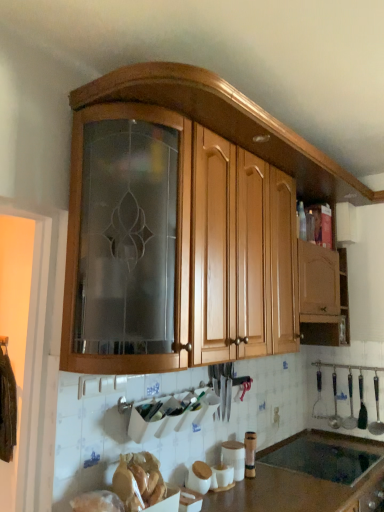
Locate an element on the screen. white matte screen door at left is located at coordinates (28, 371).

The height and width of the screenshot is (512, 384). What are the coordinates of `metallic silver spoon at lower right, positioned as the second silverware in right-to-left order` in the screenshot? It's located at (350, 406).

What do you see at coordinates (350, 406) in the screenshot? This screenshot has height=512, width=384. I see `metallic silver spoon at lower right, positioned as the second silverware in right-to-left order` at bounding box center [350, 406].

This screenshot has height=512, width=384. What do you see at coordinates (234, 457) in the screenshot?
I see `white glossy canister at lower center, placed as the second appliance when sorted from left to right` at bounding box center [234, 457].

Measure the distance between point (378,425) and camera.

A distance of 2.67 meters exists between point (378,425) and camera.

Describe the element at coordinates (309, 476) in the screenshot. Image resolution: width=384 pixels, height=512 pixels. I see `brown laminate countertop at lower center` at that location.

I want to click on white matte screen door at left, so click(28, 371).

Does white matte canister at lower center, the 2th appliance from the right, turn towards black matte sink at lower center?

No, white matte canister at lower center, the 2th appliance from the right, is not aimed at black matte sink at lower center.

From a real-world perspective, between white matte canister at lower center, the second appliance positioned from the back, and black matte sink at lower center, who is vertically lower?

black matte sink at lower center is physically lower.

Considering the relative positions of white matte canister at lower center, positioned as the 1th appliance in front-to-back order, and black matte sink at lower center in the image provided, is white matte canister at lower center, positioned as the 1th appliance in front-to-back order, to the left or to the right of black matte sink at lower center?

Clearly, white matte canister at lower center, positioned as the 1th appliance in front-to-back order, is on the left of black matte sink at lower center in the image.

Considering the points (202, 487) and (293, 456), which point is in front, point (202, 487) or point (293, 456)?

The point (202, 487) is closer.

Would you say white matte canister at lower center, positioned as the 1th appliance in front-to-back order, is part of wooden cabinet at upper center's contents?

Definitely not — white matte canister at lower center, positioned as the 1th appliance in front-to-back order, is not inside wooden cabinet at upper center.

Between wooden cabinet at upper center and white matte canister at lower center, the second appliance positioned from the back, which one has larger width?

wooden cabinet at upper center.

Which is behind, point (296, 152) or point (206, 483)?

The point (296, 152) is behind.

Is the surface of wooden cabinet at upper center in direct contact with white matte canister at lower center, the second appliance positioned from the back?

There is a gap between wooden cabinet at upper center and white matte canister at lower center, the second appliance positioned from the back.

Between polished metal ladle at right, which is the 2th silverware in left-to-right order, and white glossy canister at lower center, placed as the second appliance when sorted from left to right, which one has more height?

polished metal ladle at right, which is the 2th silverware in left-to-right order, is taller.

From a real-world perspective, is polished metal ladle at right, positioned as the first silverware in right-to-left order, positioned over white glossy canister at lower center, the 1th appliance from the right, based on gravity?

Indeed, from a real-world perspective, polished metal ladle at right, positioned as the first silverware in right-to-left order, stands above white glossy canister at lower center, the 1th appliance from the right.

At what (x,y) coordinates should I click in order to perform the action: click on appliance that is the 1st one below the polished metal ladle at right, which is the 2th silverware in left-to-right order (from a real-world perspective). Please return your answer as a coordinate pair (x, y). Image resolution: width=384 pixels, height=512 pixels. Looking at the image, I should click on (234, 457).

From the image's perspective, does polished metal ladle at right, which is the 2th silverware in left-to-right order, appear higher than white glossy canister at lower center, the 1th appliance from the right?

Yes, from the image's perspective, polished metal ladle at right, which is the 2th silverware in left-to-right order, is above white glossy canister at lower center, the 1th appliance from the right.

Which is more to the left, white glossy canister at lower center, placed as the second appliance when sorted from left to right, or white matte canister at lower center, the 2th appliance from the right?

From the viewer's perspective, white matte canister at lower center, the 2th appliance from the right, appears more on the left side.

Does white glossy canister at lower center, the 1th appliance from the right, touch white matte canister at lower center, the second appliance positioned from the back?

No, white glossy canister at lower center, the 1th appliance from the right, is not next to white matte canister at lower center, the second appliance positioned from the back.

Can you confirm if white glossy canister at lower center, placed as the second appliance when sorted from left to right, is shorter than white matte canister at lower center, positioned as the 1th appliance in front-to-back order?

No, white glossy canister at lower center, placed as the second appliance when sorted from left to right, is not shorter than white matte canister at lower center, positioned as the 1th appliance in front-to-back order.

Can you confirm if black matte sink at lower center is positioned to the right of brown laminate countertop at lower center?

Correct, you'll find black matte sink at lower center to the right of brown laminate countertop at lower center.

Can you tell me how much black matte sink at lower center and brown laminate countertop at lower center differ in facing direction?

There is a 0.000223-degree angle between the facing directions of black matte sink at lower center and brown laminate countertop at lower center.

Is black matte sink at lower center in contact with brown laminate countertop at lower center?

Yes, black matte sink at lower center is beside brown laminate countertop at lower center.

Considering the sizes of objects white matte screen door at left and white glossy canister at lower center, placed as the second appliance when sorted from left to right, in the image provided, who is wider, white matte screen door at left or white glossy canister at lower center, placed as the second appliance when sorted from left to right,?

Wider between the two is white glossy canister at lower center, placed as the second appliance when sorted from left to right.

Considering the relative positions of white matte screen door at left and white glossy canister at lower center, the 1th appliance from the right, in the image provided, is white matte screen door at left in front of white glossy canister at lower center, the 1th appliance from the right,?

Yes, it is in front of white glossy canister at lower center, the 1th appliance from the right.

At what (x,y) coordinates should I click in order to perform the action: click on screen door above the white glossy canister at lower center, the second appliance when ordered from front to back (from the image's perspective). Please return your answer as a coordinate pair (x, y). The width and height of the screenshot is (384, 512). Looking at the image, I should click on (28, 371).

Is white matte screen door at left oriented away from white glossy canister at lower center, the second appliance when ordered from front to back?

No, white matte screen door at left is not facing away from white glossy canister at lower center, the second appliance when ordered from front to back.

Is black matte sink at lower center completely or partially inside white matte screen door at left?

Definitely not — black matte sink at lower center is not inside white matte screen door at left.

This screenshot has width=384, height=512. I want to click on screen door lying on the left of black matte sink at lower center, so click(x=28, y=371).

Considering their positions, is white matte screen door at left located in front of or behind black matte sink at lower center?

Clearly, white matte screen door at left is in front of black matte sink at lower center.

I want to click on sink directly beneath the white matte canister at lower center, positioned as the 1th appliance in front-to-back order (from a real-world perspective), so click(322, 460).

Image resolution: width=384 pixels, height=512 pixels. I want to click on cabinetry located on the right of white matte canister at lower center, positioned as the 1th appliance in front-to-back order, so click(223, 122).

From the picture: Which object lies nearer to the anchor point white matte screen door at left, metallic silver spoon at lower right, positioned as the second silverware in right-to-left order, or wooden cabinet at upper center?

Based on the image, wooden cabinet at upper center appears to be nearer to white matte screen door at left.

Looking at this image, from the image, which object appears to be nearer to black matte sink at lower center, metallic silver spoon at lower right, marked as the 1th silverware in a left-to-right arrangement, or white matte canister at lower center, positioned as the 1th appliance in front-to-back order?

metallic silver spoon at lower right, marked as the 1th silverware in a left-to-right arrangement, is closer to black matte sink at lower center.

From the image, which object appears to be farther from brown laminate countertop at lower center, black matte sink at lower center or white matte screen door at left?

Based on the image, white matte screen door at left appears to be further to brown laminate countertop at lower center.

Estimate the real-world distances between objects in this image. Which object is further from wooden cabinet at upper center, polished metal ladle at right, positioned as the first silverware in right-to-left order, or metallic silver spoon at lower right, marked as the 1th silverware in a left-to-right arrangement?

Based on the image, metallic silver spoon at lower right, marked as the 1th silverware in a left-to-right arrangement, appears to be further to wooden cabinet at upper center.

Which object lies further to the anchor point black matte sink at lower center, polished metal ladle at right, which is the 2th silverware in left-to-right order, or white matte screen door at left?

white matte screen door at left is positioned further to the anchor black matte sink at lower center.

Based on their spatial positions, is white matte screen door at left or white glossy canister at lower center, placed as the second appliance when sorted from left to right, further from brown laminate countertop at lower center?

white matte screen door at left.

In the scene shown: From the image, which object appears to be farther from metallic silver spoon at lower right, positioned as the second silverware in right-to-left order, polished metal ladle at right, which is the 2th silverware in left-to-right order, or black matte sink at lower center?

Based on the image, black matte sink at lower center appears to be further to metallic silver spoon at lower right, positioned as the second silverware in right-to-left order.

Looking at the image, which one is located closer to brown laminate countertop at lower center, black matte sink at lower center or white matte canister at lower center, the second appliance positioned from the back?

The object closer to brown laminate countertop at lower center is black matte sink at lower center.

The image size is (384, 512). Identify the location of silverware situated between white matte screen door at left and polished metal ladle at right, which is the 2th silverware in left-to-right order, from left to right. (350, 406).

You are a GUI agent. You are given a task and a screenshot of the screen. Output one action in this format:
    pyautogui.click(x=<x>, y=<y>)
    Task: Click on the sink between brown laminate countertop at lower center and polished metal ladle at right, which is the 2th silverware in left-to-right order, from front to back
    This screenshot has height=512, width=384.
    Given the screenshot: What is the action you would take?
    pos(322,460)

Locate an element on the screen. The height and width of the screenshot is (512, 384). silverware between brown laminate countertop at lower center and metallic silver spoon at lower right, positioned as the second silverware in right-to-left order, in the front-back direction is located at coordinates (376, 412).

This screenshot has height=512, width=384. Find the location of `cabinetry between white matte screen door at left and black matte sink at lower center`. cabinetry between white matte screen door at left and black matte sink at lower center is located at coordinates (223, 122).